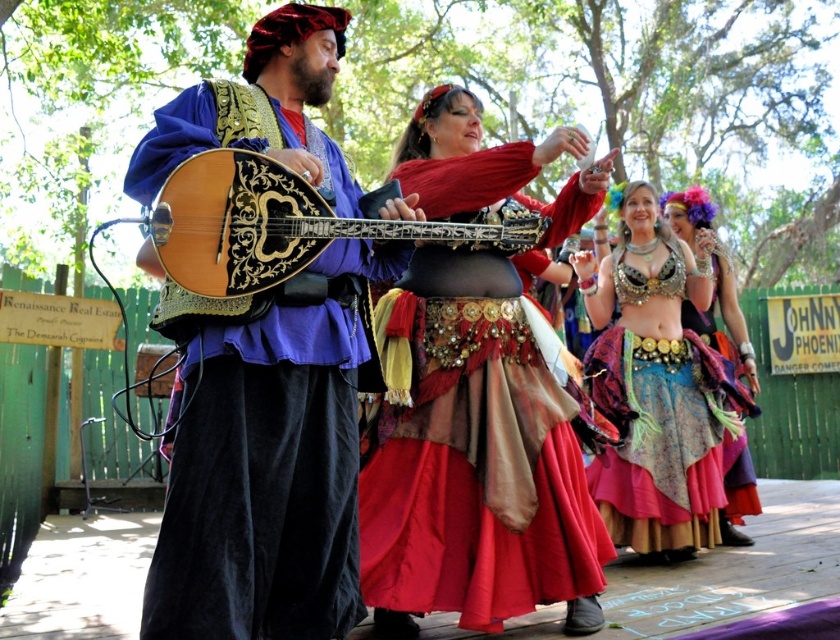
Question: Can you confirm if multicolored fabric skirt at center is positioned above multicolored fabric skirt at right?

Choices:
 (A) no
 (B) yes

Answer: (A)

Question: Can you confirm if velvet blue tunic at center is positioned above shiny gold belt at center?

Choices:
 (A) yes
 (B) no

Answer: (A)

Question: Is velvet blue tunic at center to the left of wooden glossy mandolin at center from the viewer's perspective?

Choices:
 (A) yes
 (B) no

Answer: (A)

Question: Which of the following is the closest to the observer?

Choices:
 (A) (260, 328)
 (B) (654, 272)
 (C) (732, 364)
 (D) (248, 248)

Answer: (D)

Question: Estimate the real-world distances between objects in this image. Which object is farther from the wooden glossy mandolin at center?

Choices:
 (A) velvet blue tunic at center
 (B) shiny gold belt at center
 (C) multicolored fabric skirt at right

Answer: (C)

Question: Which object is farther from the camera taking this photo?

Choices:
 (A) multicolored fabric skirt at center
 (B) multicolored fabric skirt at right
 (C) wooden glossy mandolin at center
 (D) velvet blue tunic at center

Answer: (B)